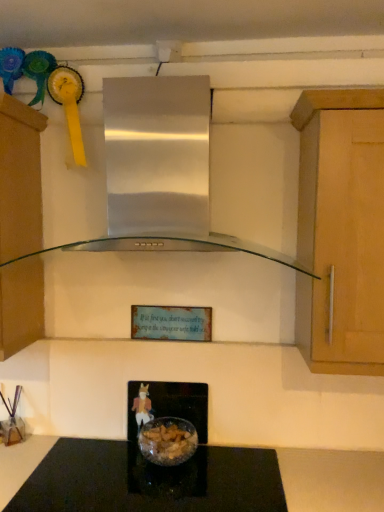
The height and width of the screenshot is (512, 384). I want to click on vacant space positioned to the left of translucent glass bowl at center, so click(118, 461).